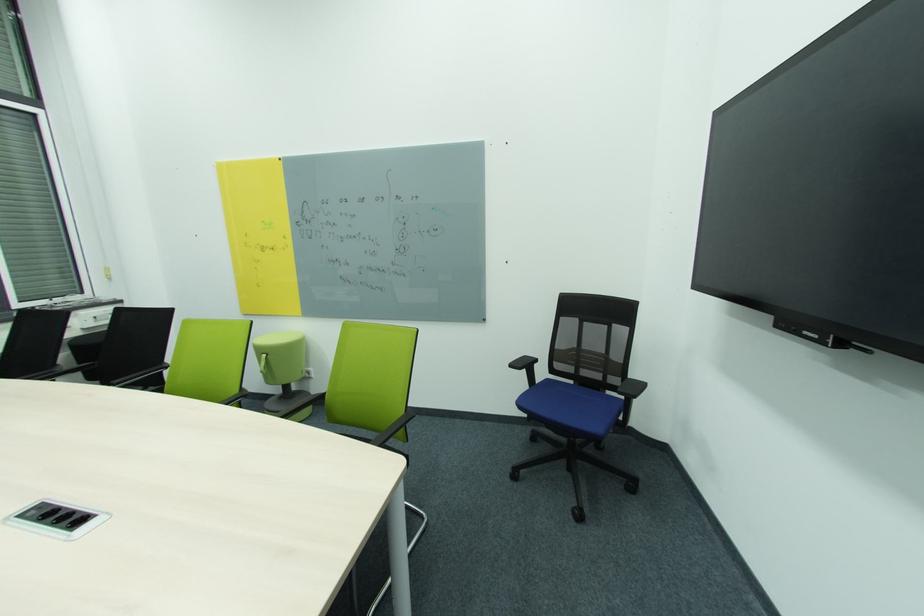
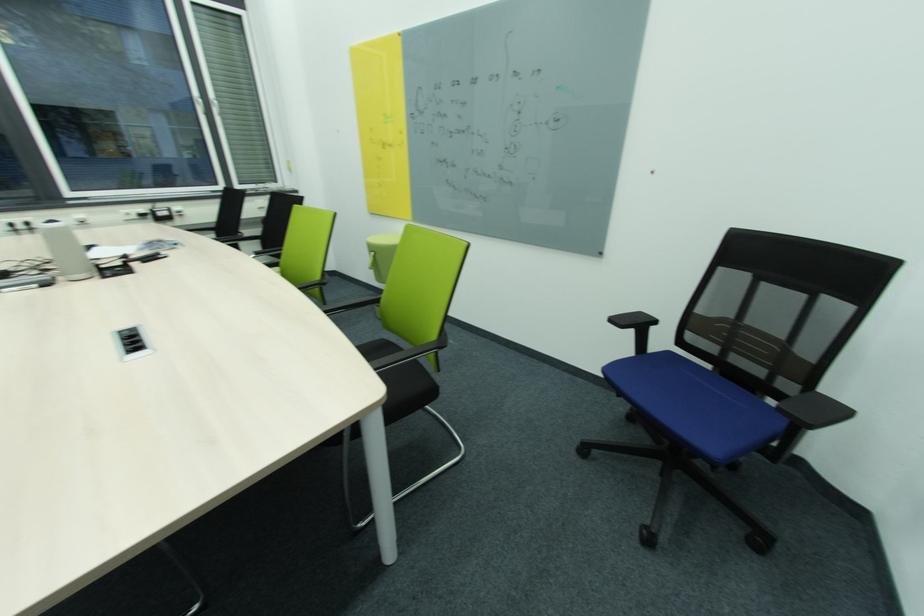
Find the pixel in the second image that matches (517,367) in the first image.

(617, 321)